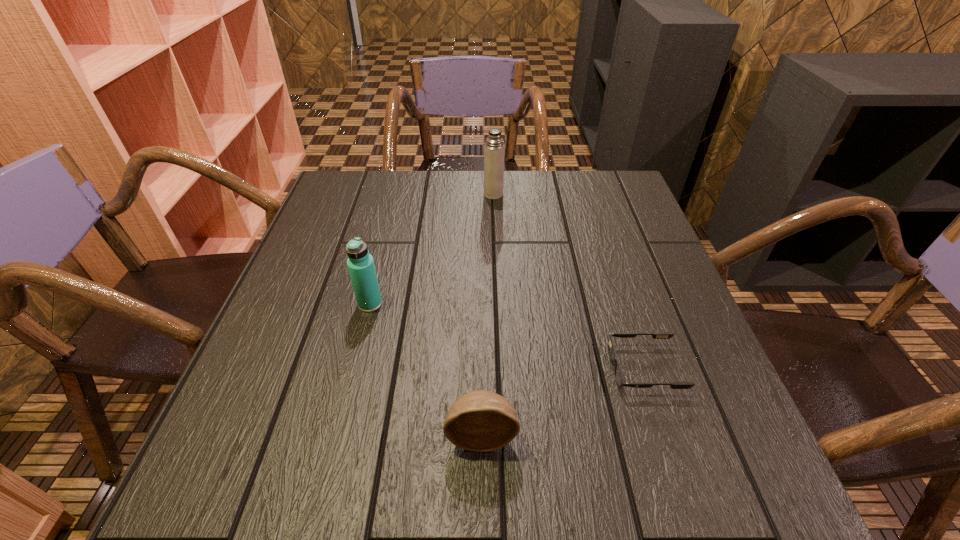
Identify the location of the right thermos bottle. (494, 149).

This screenshot has width=960, height=540. What are the coordinates of `the farthest object` in the screenshot? It's located at (494, 149).

This screenshot has height=540, width=960. In order to click on the nearer thermos bottle in this screenshot , I will do `click(360, 263)`.

Find the location of a particular element. The width and height of the screenshot is (960, 540). the third nearest object is located at coordinates (360, 263).

Where is `the nearest object`? Image resolution: width=960 pixels, height=540 pixels. the nearest object is located at coordinates (480, 420).

The height and width of the screenshot is (540, 960). What are the coordinates of `bowl` in the screenshot? It's located at pos(480,420).

Locate an element on the screen. sunglasses is located at coordinates (619, 378).

In order to click on the shortest object in this screenshot , I will do `click(619, 378)`.

Locate an element on the screen. The image size is (960, 540). blank space located on the left of the right thermos bottle is located at coordinates (350, 194).

This screenshot has width=960, height=540. I want to click on free region located on the front of the second farthest object, so click(335, 446).